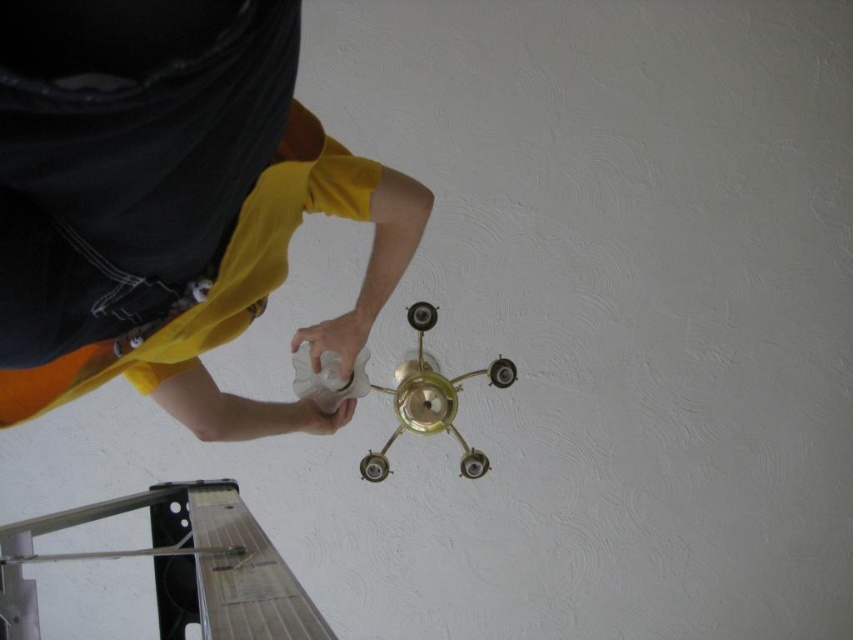
Question: Based on their relative distances, which object is nearer to the gold metallic chandelier at center?

Choices:
 (A) yellow matte shirt at upper center
 (B) white matte bottle at center

Answer: (B)

Question: Which object is closer to the camera taking this photo?

Choices:
 (A) yellow matte shirt at upper center
 (B) white matte bottle at center

Answer: (A)

Question: Is yellow matte shirt at upper center below gold metallic chandelier at center?

Choices:
 (A) yes
 (B) no

Answer: (B)

Question: From the image, what is the correct spatial relationship of yellow matte shirt at upper center in relation to white matte bottle at center?

Choices:
 (A) left
 (B) right

Answer: (B)

Question: Considering the relative positions of gold metallic chandelier at center and white matte bottle at center in the image provided, where is gold metallic chandelier at center located with respect to white matte bottle at center?

Choices:
 (A) right
 (B) left

Answer: (A)

Question: Estimate the real-world distances between objects in this image. Which object is closer to the white matte bottle at center?

Choices:
 (A) gold metallic chandelier at center
 (B) yellow matte shirt at upper center

Answer: (B)